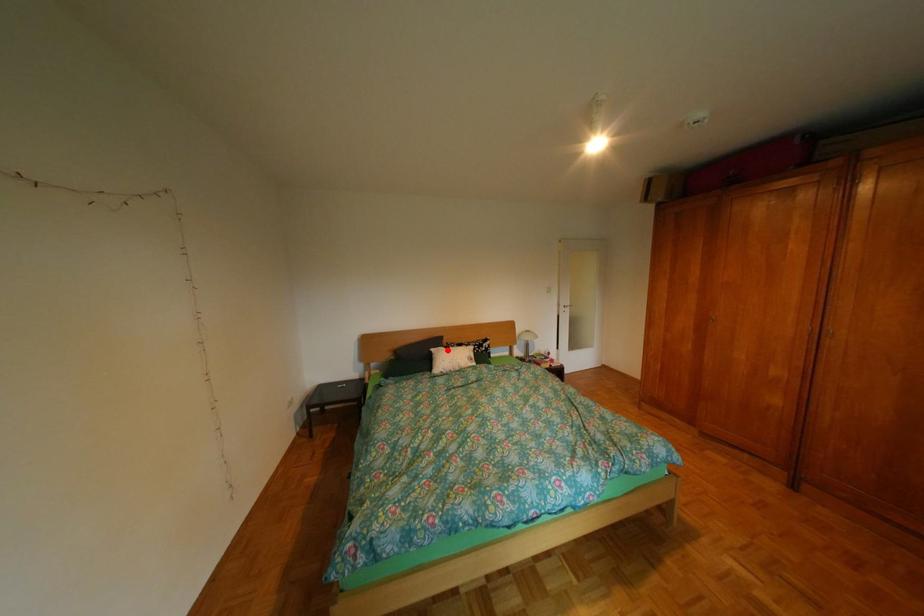
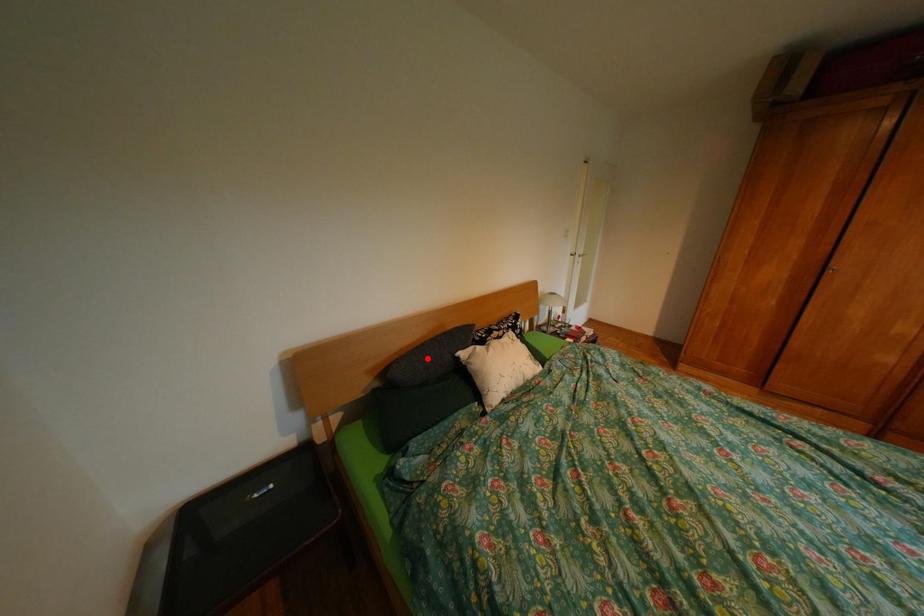
I am providing you with two images of the same scene from different viewpoints. A red point is marked on the first image and another point is marked on the second image. Do the highlighted points in image1 and image2 indicate the same real-world spot?

No